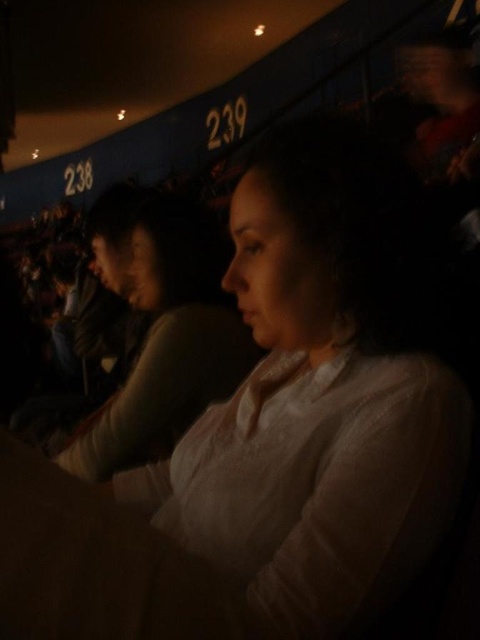
Question: Among these points, which one is nearest to the camera?

Choices:
 (A) (133, 365)
 (B) (396, 472)

Answer: (B)

Question: Is white matte shirt at center wider than light pink fabric shirt at center?

Choices:
 (A) yes
 (B) no

Answer: (A)

Question: Among these points, which one is nearest to the camera?

Choices:
 (A) (445, 476)
 (B) (186, 349)

Answer: (A)

Question: From the image, what is the correct spatial relationship of white matte shirt at center in relation to light pink fabric shirt at center?

Choices:
 (A) below
 (B) above

Answer: (A)

Question: Does white matte shirt at center appear on the right side of light pink fabric shirt at center?

Choices:
 (A) no
 (B) yes

Answer: (B)